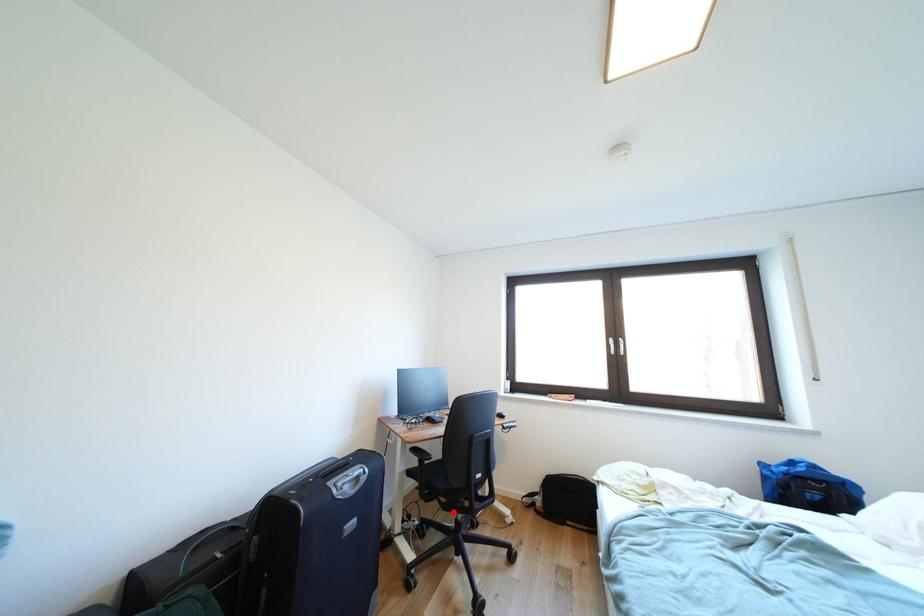
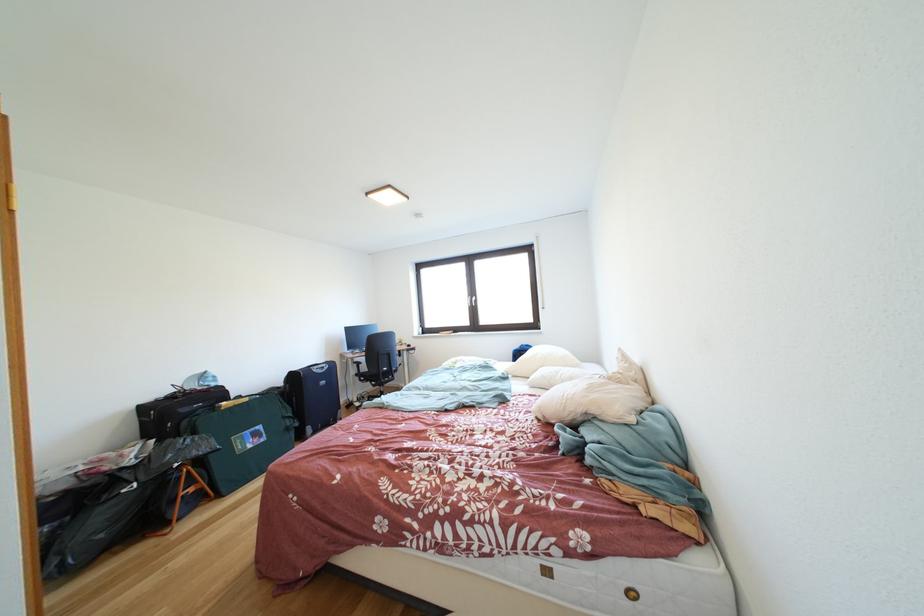
Question: I am providing you with two images of the same scene from different viewpoints. Image1 has a red point marked. In image2, the corresponding 3D location appears at what relative position? Reply with the corresponding letter.

Choices:
 (A) Closer
 (B) Farther

Answer: (A)